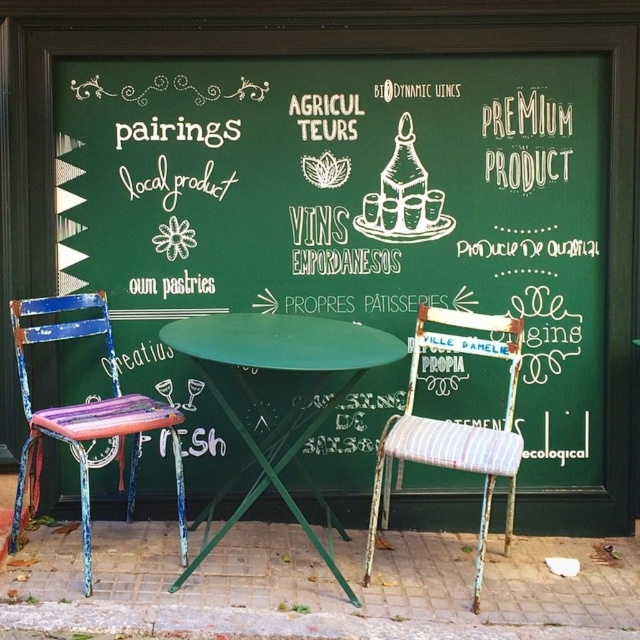
Question: Is striped fabric chair at center wider than distressed wood chair at left?

Choices:
 (A) no
 (B) yes

Answer: (A)

Question: Which point is farther to the camera?

Choices:
 (A) (227, 227)
 (B) (468, 433)

Answer: (A)

Question: Can you confirm if green chalkboard at center is positioned below green metal table at center?

Choices:
 (A) yes
 (B) no

Answer: (B)

Question: Which point is farther from the camera taking this photo?

Choices:
 (A) (397, 346)
 (B) (524, 420)

Answer: (B)

Question: Which point is closer to the camera?

Choices:
 (A) (58, 410)
 (B) (192, 356)

Answer: (B)

Question: Does green chalkboard at center appear on the right side of green metal table at center?

Choices:
 (A) yes
 (B) no

Answer: (A)